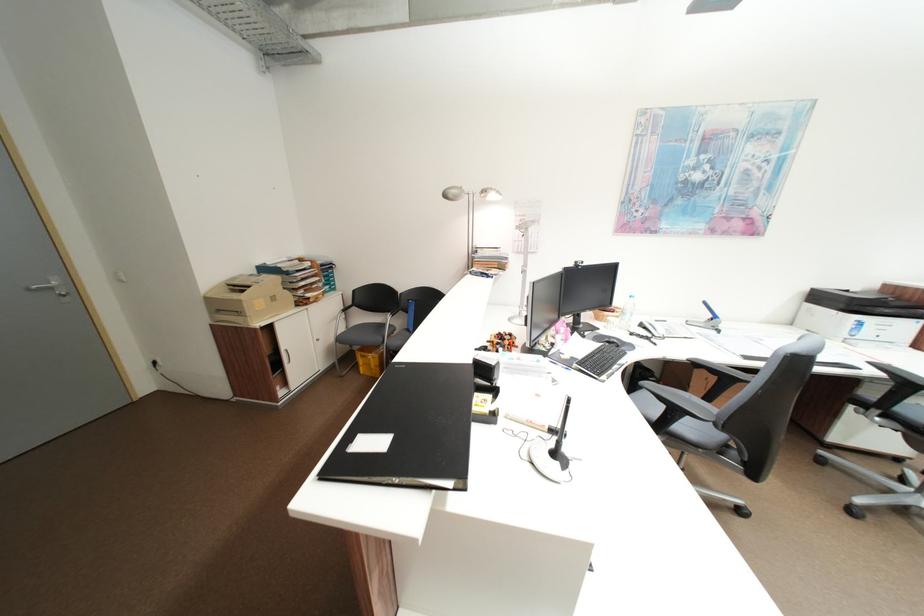
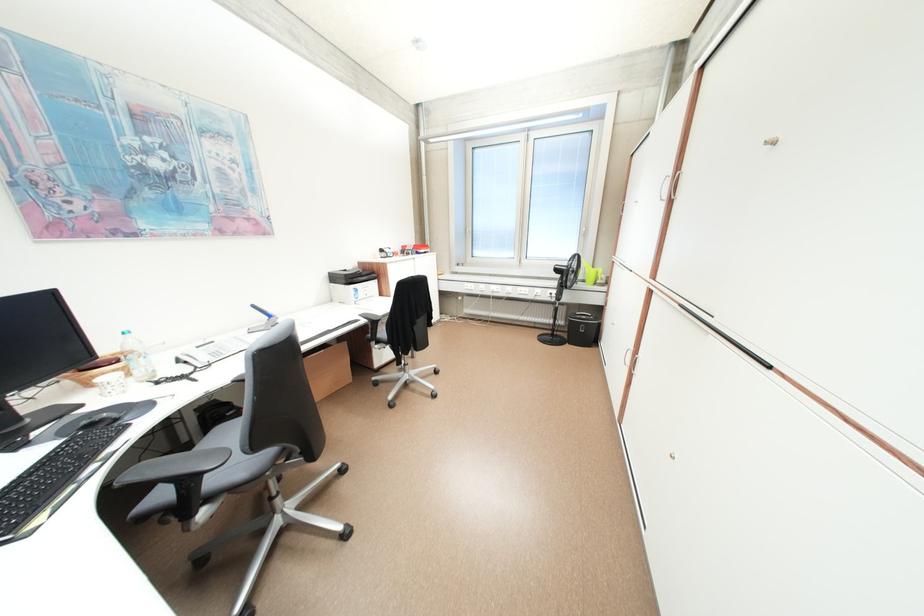
Locate, in the second image, the point that corresponds to the point at 651,326 in the first image.

(188, 362)